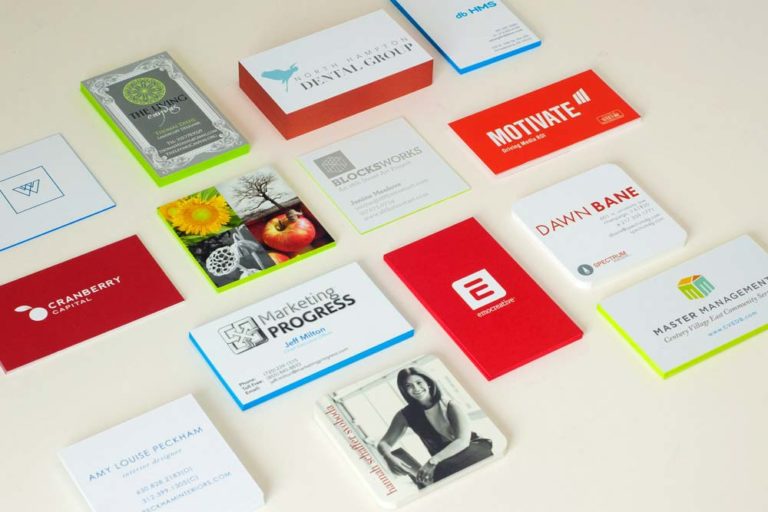
Locate an element on the screen. The width and height of the screenshot is (768, 512). off white counter is located at coordinates (630, 460).